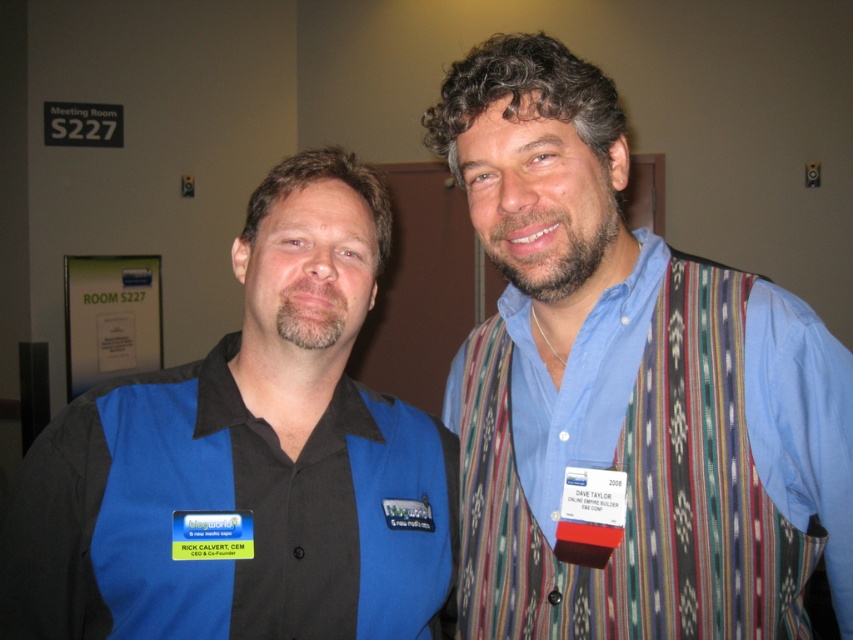
In the scene shown: You are organizing a photo shoot and need to ensure that the blue striped vest at center and the black matte shirt at center are visible in the frame. Based on their sizes, which one might require more space in the camera frame to be fully captured?

The black matte shirt at center requires more space in the camera frame because it has a greater width than the blue striped vest at center.

You are organizing a clothing donation drive and need to categorize items by size. You have a blue striped vest at center and a black matte shirt at center. Which item should you place in the large size bin?

The blue striped vest at center is larger in size than the black matte shirt at center, so the blue striped vest at center should be placed in the large size bin.